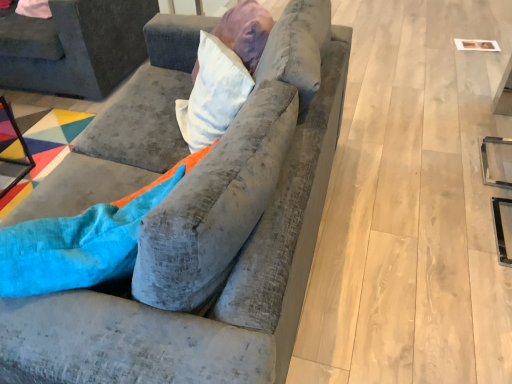
Locate an element on the screen. vacant space to the right of velvet gray couch at center, acting as the 1th studio couch starting from the front is located at coordinates (411, 208).